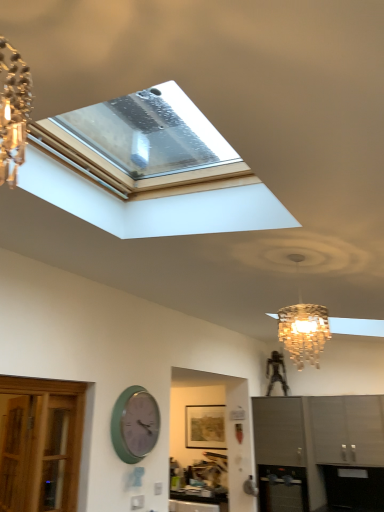
Question: Can you confirm if green matte wall clock at lower left is shorter than matte gray cabinet at lower right, which is counted as the 1th cabinetry, starting from the left?

Choices:
 (A) no
 (B) yes

Answer: (B)

Question: From a real-world perspective, is green matte wall clock at lower left under matte gray cabinet at lower right, which is counted as the 1th cabinetry, starting from the left?

Choices:
 (A) yes
 (B) no

Answer: (B)

Question: From the image's perspective, is green matte wall clock at lower left over matte gray cabinet at lower right, which is counted as the 1th cabinetry, starting from the left?

Choices:
 (A) yes
 (B) no

Answer: (A)

Question: Is green matte wall clock at lower left not within matte gray cabinet at lower right, which is counted as the 1th cabinetry, starting from the left?

Choices:
 (A) no
 (B) yes

Answer: (B)

Question: Is green matte wall clock at lower left at the left side of matte gray cabinet at lower right, marked as the 2th cabinetry in a right-to-left arrangement?

Choices:
 (A) no
 (B) yes

Answer: (B)

Question: Is green matte wall clock at lower left inside or outside of metallic stainless steel oven at lower center?

Choices:
 (A) outside
 (B) inside

Answer: (A)

Question: In the image, is green matte wall clock at lower left positioned in front of or behind metallic stainless steel oven at lower center?

Choices:
 (A) front
 (B) behind

Answer: (A)

Question: Is point (134, 387) positioned closer to the camera than point (273, 504)?

Choices:
 (A) closer
 (B) farther

Answer: (A)

Question: From the image's perspective, is green matte wall clock at lower left positioned above or below metallic stainless steel oven at lower center?

Choices:
 (A) below
 (B) above

Answer: (B)

Question: Is satin gray cabinet at lower right, which is counted as the first cabinetry, starting from the right, spatially inside green matte wall clock at lower left, or outside of it?

Choices:
 (A) outside
 (B) inside

Answer: (A)

Question: Is satin gray cabinet at lower right, which is counted as the first cabinetry, starting from the right, in front of or behind green matte wall clock at lower left in the image?

Choices:
 (A) front
 (B) behind

Answer: (B)

Question: Is point (349, 426) positioned closer to the camera than point (122, 428)?

Choices:
 (A) closer
 (B) farther

Answer: (B)

Question: From a real-world perspective, relative to green matte wall clock at lower left, is satin gray cabinet at lower right, which is counted as the first cabinetry, starting from the right, vertically above or below?

Choices:
 (A) above
 (B) below

Answer: (B)

Question: Which is correct: matte gray cabinet at lower right, marked as the 2th cabinetry in a right-to-left arrangement, is inside green matte wall clock at lower left, or outside of it?

Choices:
 (A) outside
 (B) inside

Answer: (A)

Question: Is matte gray cabinet at lower right, marked as the 2th cabinetry in a right-to-left arrangement, taller or shorter than green matte wall clock at lower left?

Choices:
 (A) short
 (B) tall

Answer: (B)